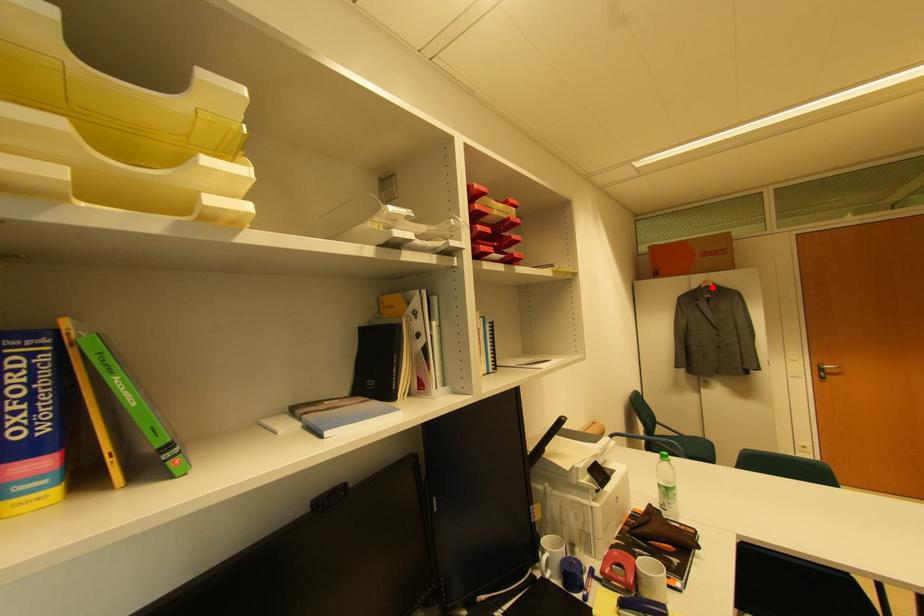
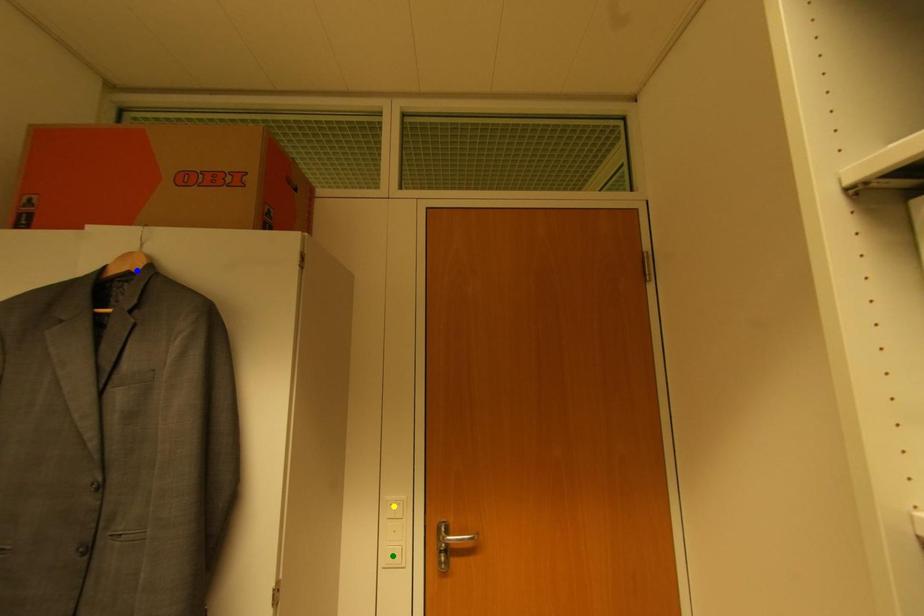
Question: I am providing you with two images of the same scene from different viewpoints. A red point is marked on the first image. You are given multiple points on the second image. Which spot in image 2 lines up with the point in image 1?

Choices:
 (A) green point
 (B) yellow point
 (C) blue point

Answer: (C)